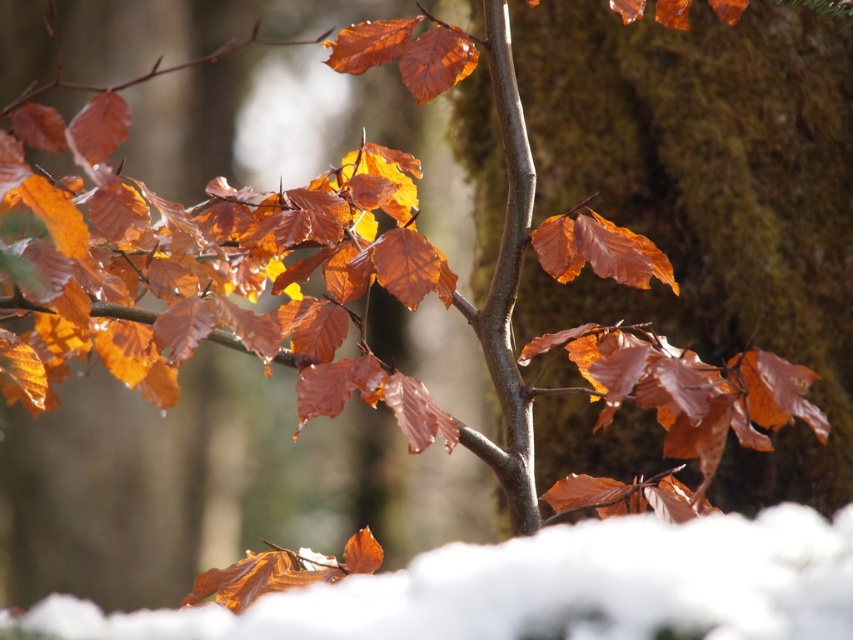
Looking at this image, you are standing in the forest and want to place a small snowman exactly where the white fluffy snow at lower center is located. According to the coordinates given, is this location suitable for building the snowman?

The white fluffy snow at lower center is located at coordinates point (544, 588), so yes, this location is suitable for building the snowman as it is the exact spot where the snow is present.

You are standing in the snow and see two points marked on the tree branch. The first point is at coordinates point (x=785, y=634) and the second is at point (x=508, y=449). Which point is closer to you?

Point (x=785, y=634) is in front of point (x=508, y=449), so the first point is closer to you.

You are standing in a snowy forest and want to take a photo of the white fluffy snow at lower center and the smooth bark tree trunk at center. Which object will appear larger in your photo?

The white fluffy snow at lower center will appear larger in the photo because it is closer to the viewer than the smooth bark tree trunk at center.